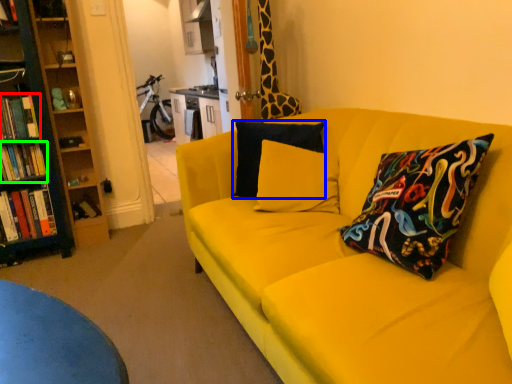
Question: Which object is positioned closest to book (highlighted by a red box)? Select from pillow (highlighted by a blue box) and book (highlighted by a green box).

Choices:
 (A) pillow
 (B) book

Answer: (B)